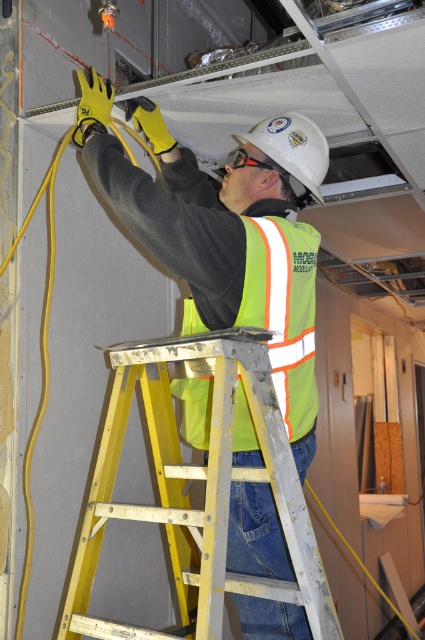
You are a construction supervisor checking the safety of the work area. The yellow metallic ladder at center is positioned at coordinates point (204, 486). According to safety standards, ladders must be placed at a 75 degree angle with the ground. Can you determine if the ladder is positioned safely based on its coordinates?

The point (204, 486) corresponds to the yellow metallic ladder at center, but coordinates alone cannot determine the ladder angle. Additional information like ladder height or base distance from the wall is needed to calculate the angle.